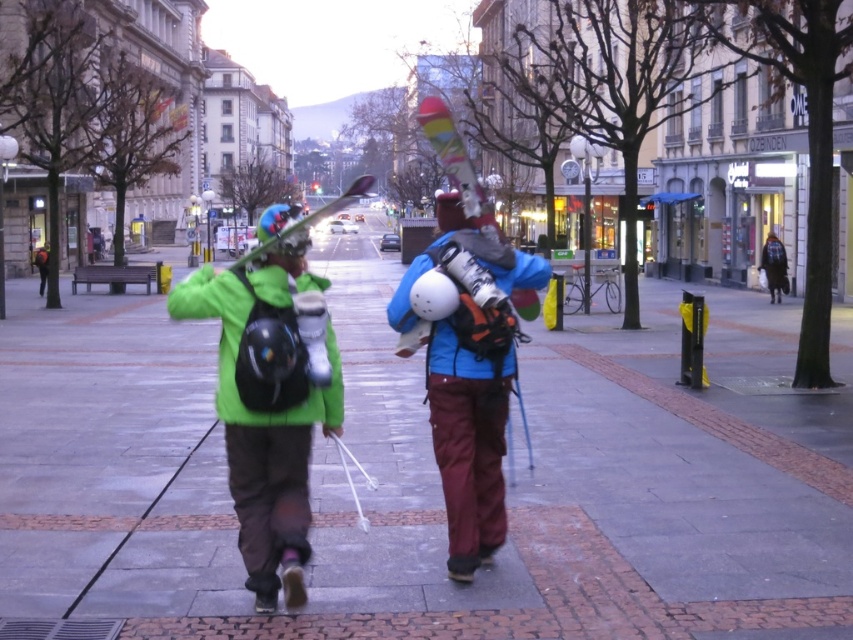
You are standing on the pedestrian walkway and see a matte green jacket at center and a matte blue snowboard at center. Which object is positioned to the right of the other?

The matte blue snowboard at center is positioned to the right of the matte green jacket at center.

You are a photographer standing on the sidewalk and want to take a photo of the matte green jacket at center and the matte green ski at center. Which object should you focus on first if you want to capture both in the frame without moving the camera?

You should focus on the matte green jacket at center first because it is closer to you than the matte green ski at center, allowing both to be in the frame without needing to adjust the camera position.